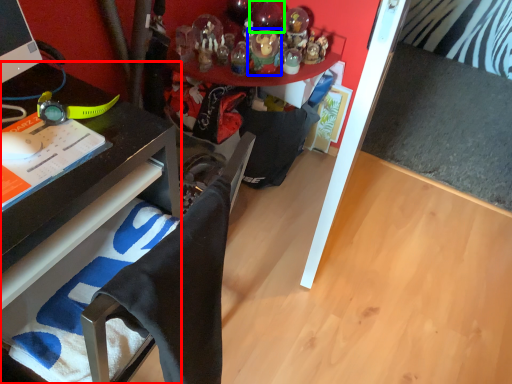
Question: Estimate the real-world distances between objects in this image. Which object is closer to desk (highlighted by a red box), toy (highlighted by a blue box) or toy (highlighted by a green box)?

Choices:
 (A) toy
 (B) toy

Answer: (A)